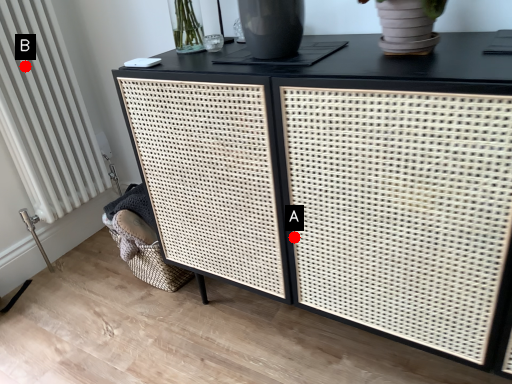
Question: Two points are circled on the image, labeled by A and B beside each circle. Which point is closer to the camera?

Choices:
 (A) A is closer
 (B) B is closer

Answer: (A)